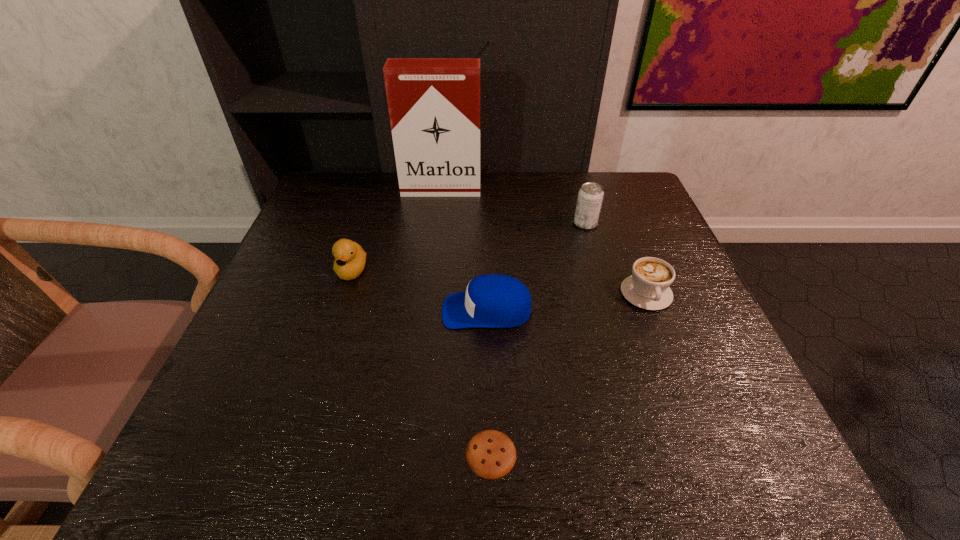
What are the coordinates of `vacant area that lies between the fifth nearest object and the leftmost object` in the screenshot? It's located at (468, 247).

This screenshot has height=540, width=960. In order to click on empty space that is in between the soda can and the duckling in this screenshot , I will do `click(468, 247)`.

Where is `empty location between the fifth object from left to right and the farthest object`? Image resolution: width=960 pixels, height=540 pixels. empty location between the fifth object from left to right and the farthest object is located at coordinates (514, 207).

You are a GUI agent. You are given a task and a screenshot of the screen. Output one action in this format:
    pyautogui.click(x=<x>, y=<y>)
    Task: Click on the free point between the soda can and the farthest object
    The height and width of the screenshot is (540, 960).
    Given the screenshot: What is the action you would take?
    pyautogui.click(x=514, y=207)

The width and height of the screenshot is (960, 540). In order to click on blank region between the cigarette_case and the duckling in this screenshot , I will do `click(396, 230)`.

Locate an element on the screen. The height and width of the screenshot is (540, 960). free spot between the baseball cap and the soda can is located at coordinates [x=537, y=267].

This screenshot has width=960, height=540. What are the coordinates of `free area in between the baseball cap and the duckling` in the screenshot? It's located at (420, 291).

The image size is (960, 540). In order to click on vacant area between the fifth nearest object and the cappuccino in this screenshot , I will do `click(616, 259)`.

Identify the location of the fourth closest object relative to the nearest object. The width and height of the screenshot is (960, 540). (590, 197).

Image resolution: width=960 pixels, height=540 pixels. Find the location of `object that ranks as the fourth closest to the cappuccino`. object that ranks as the fourth closest to the cappuccino is located at coordinates (434, 103).